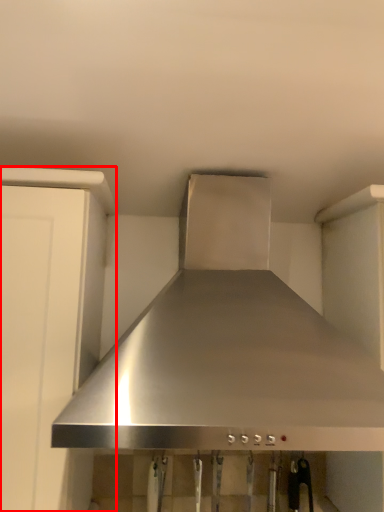
Question: From the image's perspective, what is the correct spatial positioning of cabinetry (annotated by the red box) in reference to home appliance?

Choices:
 (A) below
 (B) above

Answer: (A)